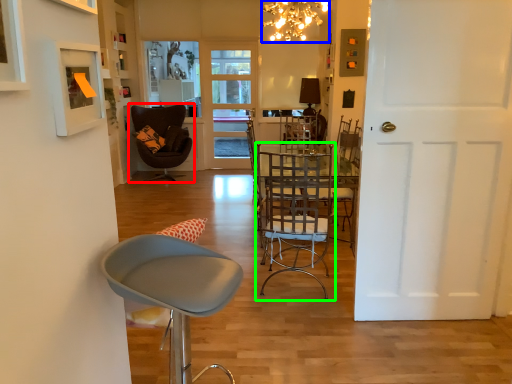
Question: Based on their relative distances, which object is farther from chair (highlighted by a red box)? Choose from lamp (highlighted by a blue box) and chair (highlighted by a green box).

Choices:
 (A) lamp
 (B) chair

Answer: (B)